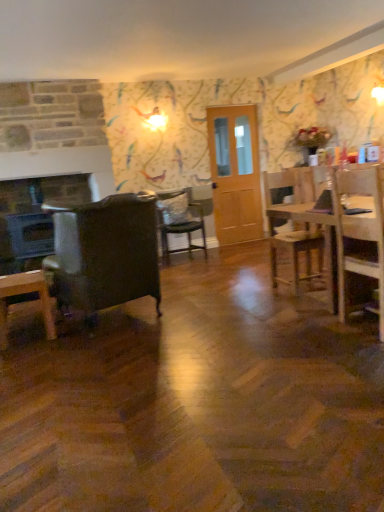
Question: Is light brown wooden door at center spatially inside white soft pillow at center, or outside of it?

Choices:
 (A) inside
 (B) outside

Answer: (B)

Question: Considering the positions of point (213, 183) and point (168, 193), is point (213, 183) closer or farther from the camera than point (168, 193)?

Choices:
 (A) farther
 (B) closer

Answer: (A)

Question: Which is nearer to the wooden desk at lower left?

Choices:
 (A) wooden chair at right, positioned as the second chair in front-to-back order
 (B) wooden table at right
 (C) light brown wooden door at center
 (D) matte black fireplace at left
 (E) black matte laptop at center

Answer: (B)

Question: Estimate the real-world distances between objects in this image. Which object is closer to the black matte laptop at center?

Choices:
 (A) velvet cushioned chair at center, positioned as the second chair in left-to-right order
 (B) wooden table at right
 (C) white soft pillow at center
 (D) light brown wooden door at center
 (E) wooden chair at right, positioned as the 3th chair in left-to-right order

Answer: (B)